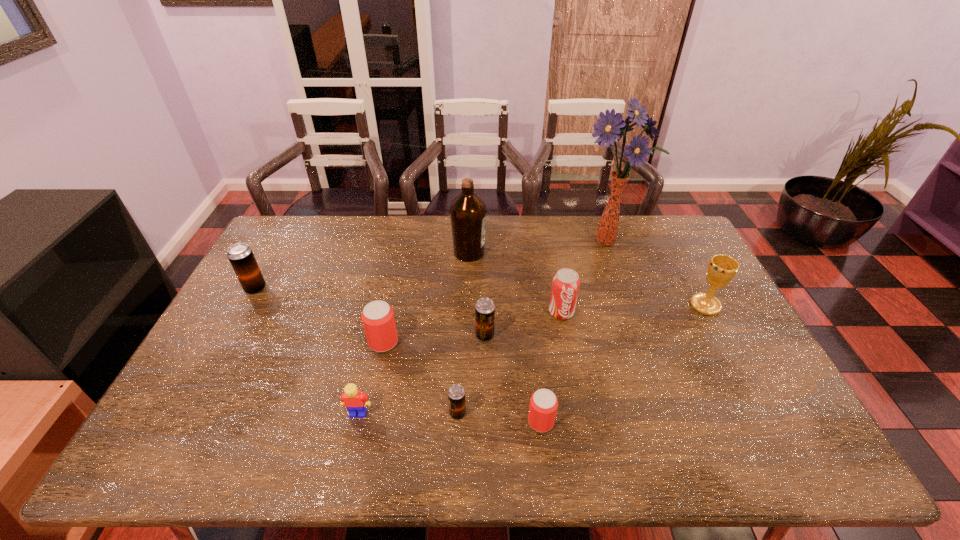
Identify the location of vacant space positioned 0.170m on the label of the ninth shortest object. This screenshot has width=960, height=540. (535, 253).

Where is `free space located 0.180m on the back of the gold chalice`? This screenshot has width=960, height=540. free space located 0.180m on the back of the gold chalice is located at coordinates (681, 259).

The image size is (960, 540). In order to click on vacant region located 0.240m on the back of the leftmost object in this screenshot , I will do `click(283, 238)`.

Identify the location of free space located 0.150m on the logo side of the soda can. The image size is (960, 540). (570, 362).

I want to click on free location located 0.340m on the right of the left red beer can, so click(x=517, y=342).

Find the location of a particular element. vacant area situated 0.270m on the front of the second biggest black beer can is located at coordinates (486, 430).

Find the location of a particular element. This screenshot has width=960, height=540. free space located on the front-facing side of the Lego is located at coordinates (347, 467).

Where is `vacant region located 0.150m on the left of the seventh object from left to right`? The height and width of the screenshot is (540, 960). vacant region located 0.150m on the left of the seventh object from left to right is located at coordinates (467, 421).

What are the coordinates of `vacant space situated on the left of the nearest black beer can` in the screenshot? It's located at (341, 413).

The image size is (960, 540). I want to click on flower arrangement located at the far edge, so click(608, 128).